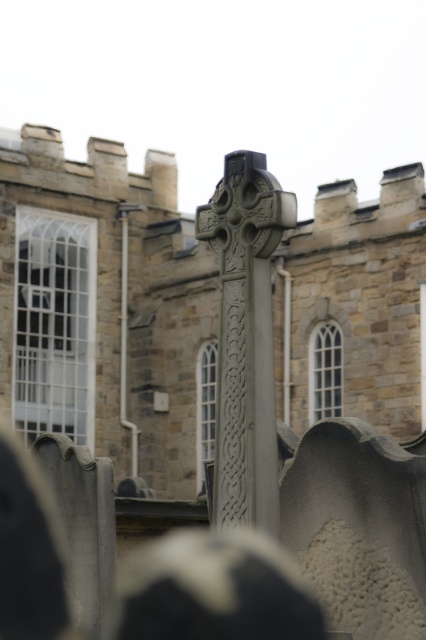
In the scene shown: You are standing at the point with coordinates point (x=232, y=348) and want to walk towards the point with coordinates point (x=25, y=333). Will the stone Celtic cross block your path?

Point (x=25, y=333) is behind point (x=232, y=348), so the stone Celtic cross will block your path.

You are a tourist visiting the cemetery and want to take a photo of the gray stone cross at center from the gray stone church at center. Given that your camera has a maximum focus range of 60 meters, will you be able to capture the cross clearly?

The distance between the gray stone church at center and the gray stone cross at center is 67.47 meters. Since your camera can only focus up to 60 meters, you will not be able to capture the cross clearly from that location.

You are a visitor at this cemetery and want to take a photo of the gray stone cross at center and the gray stone church at center. Based on their positions, which one should you focus on first if you want both to be in clear focus?

The gray stone church at center is below the gray stone cross at center, so you should focus on the gray stone cross at center first to ensure both are in clear focus.